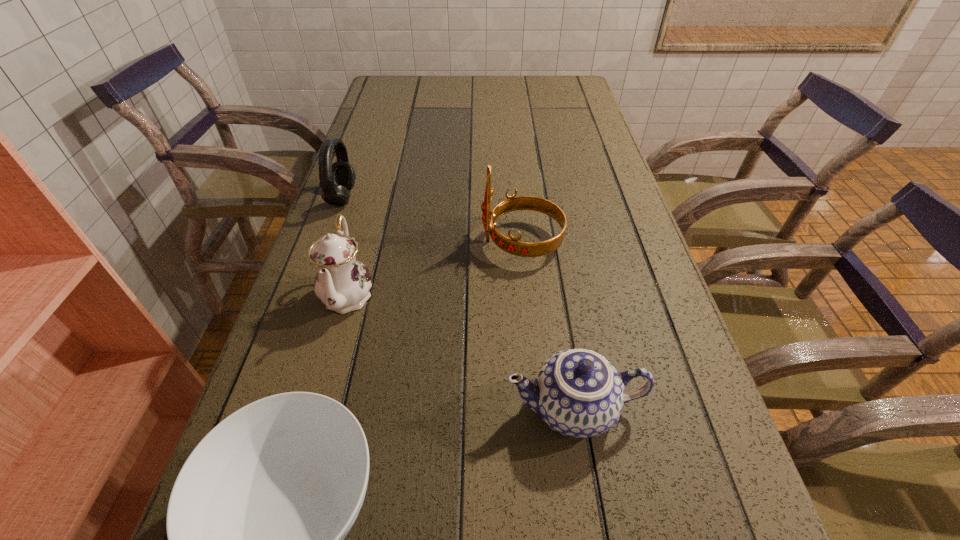
Find the location of `blank region between the rightmost chinaware and the headset`. blank region between the rightmost chinaware and the headset is located at coordinates (458, 303).

Image resolution: width=960 pixels, height=540 pixels. Find the location of `vacant area between the tiara and the rightmost chinaware`. vacant area between the tiara and the rightmost chinaware is located at coordinates (547, 325).

In order to click on free space between the rightmost chinaware and the farthest chinaware in this screenshot , I will do `click(461, 351)`.

Locate an element on the screen. The width and height of the screenshot is (960, 540). unoccupied position between the farthest object and the rightmost chinaware is located at coordinates (458, 303).

Find the location of `free area in between the farthest object and the tiara`. free area in between the farthest object and the tiara is located at coordinates click(x=432, y=220).

Image resolution: width=960 pixels, height=540 pixels. What are the coordinates of `object that is the closest to the tallest chinaware` in the screenshot? It's located at (337, 179).

Identify the location of the third closest object to the farthest chinaware. (512, 245).

Identify which chinaware is located as the second nearest to the rightmost chinaware. Please provide its 2D coordinates. Your answer should be formatted as a tuple, i.e. [(x, y)], where the tuple contains the x and y coordinates of a point satisfying the conditions above.

[(342, 283)]

Identify the location of chinaware that stands as the closest to the farthest object. This screenshot has width=960, height=540. (342, 283).

Where is `free location that satisfies the following two spatial constraints: 1. on the front-facing side of the tiara; 2. on the front side of the farthest chinaware`? The height and width of the screenshot is (540, 960). free location that satisfies the following two spatial constraints: 1. on the front-facing side of the tiara; 2. on the front side of the farthest chinaware is located at coordinates (526, 294).